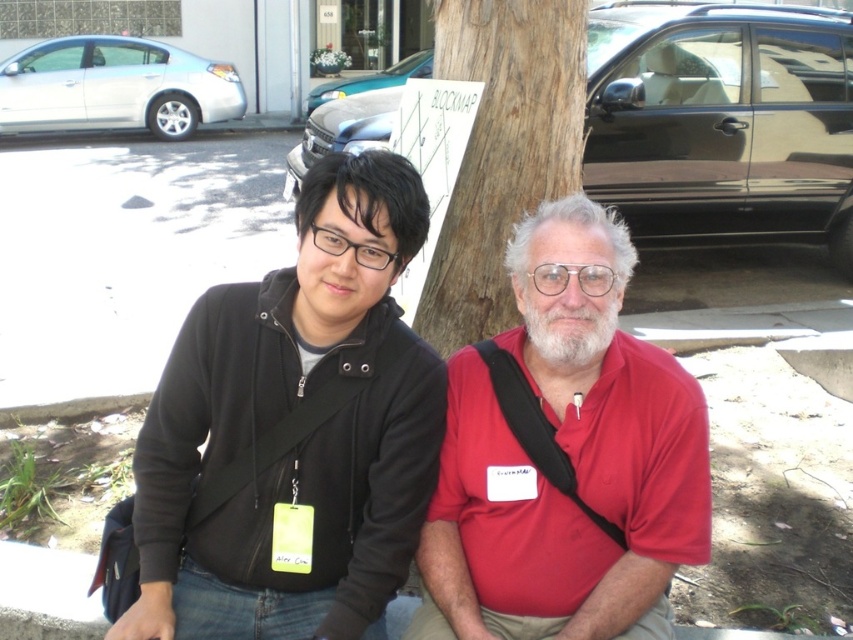
You are a photographer trying to capture a clear photo of the red matte shirt at center and the brown textured tree trunk at center. Which object should you focus on first to ensure both are in focus?

The red matte shirt at center is in front of the brown textured tree trunk at center, so you should focus on the red matte shirt at center first to ensure both are in focus.

You are a photographer standing in front of the red matte shirt at center and the brown textured tree trunk at center. You want to take a photo where both subjects are in focus. Which subject should you focus on to ensure both are sharp?

You should focus on the brown textured tree trunk at center because it is taller than the red matte shirt at center, so focusing on the farther object will keep both in focus.